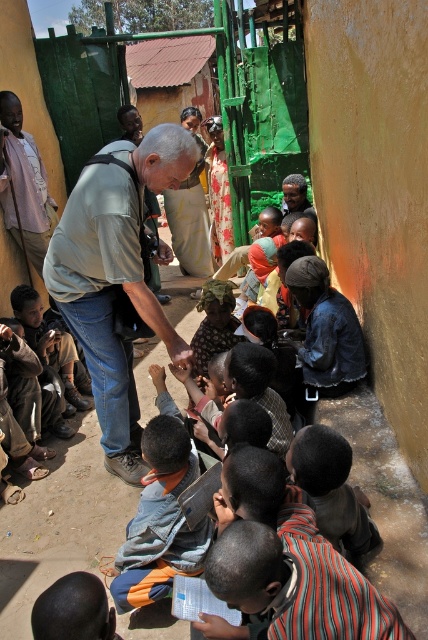
You are a photographer trying to capture a group photo of the striped shirt at lower right and matte pink shirt at upper left. Which shirt should you position closer to the camera to ensure both are fully visible in the frame?

The striped shirt at lower right is wider than the matte pink shirt at upper left, so positioning the striped shirt at lower right closer to the camera will help ensure both shirts are fully visible in the frame.

You are a photographer trying to capture a candid shot of the striped shirt at lower right and the brown leather shoes at lower left. Since you want both subjects to be in focus, you need to know which one is narrower. Which object is narrower?

The striped shirt at lower right has a lesser width compared to the brown leather shoes at lower left, so the striped shirt at lower right is narrower.